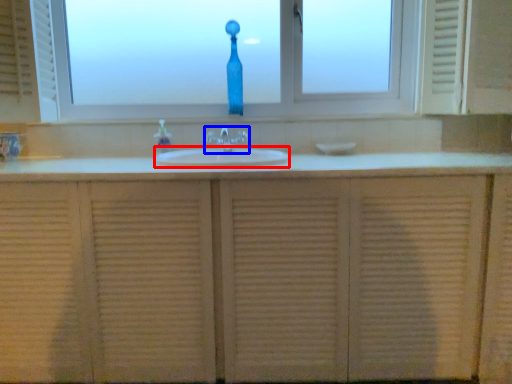
Question: Which of the following is the farthest to the observer, sink (highlighted by a red box) or tap (highlighted by a blue box)?

Choices:
 (A) sink
 (B) tap

Answer: (B)